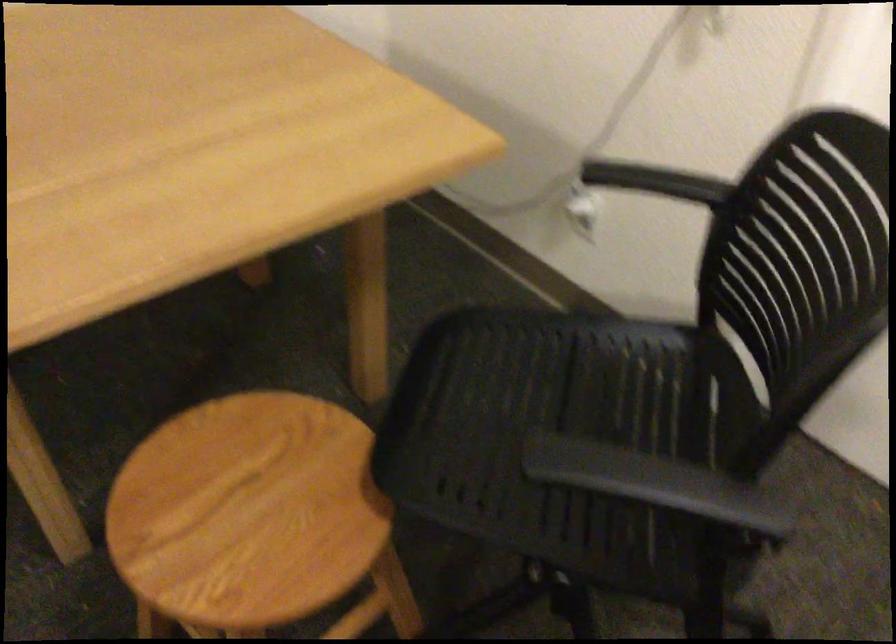
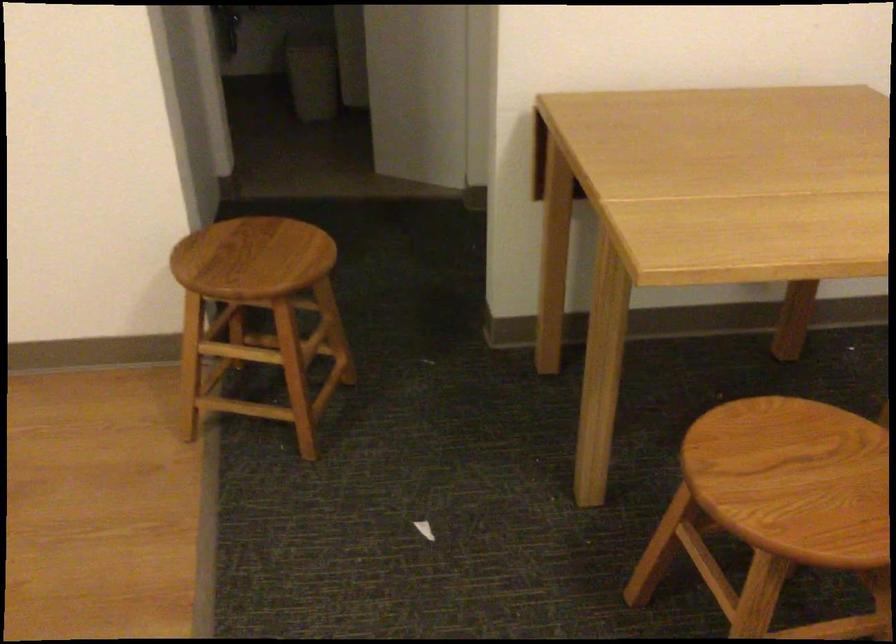
Question: The camera is either moving clockwise (left) or counter-clockwise (right) around the object. The first image is from the beginning of the video and the second image is from the end. Is the camera moving left or right when shooting the video?

Choices:
 (A) Left
 (B) Right

Answer: (B)